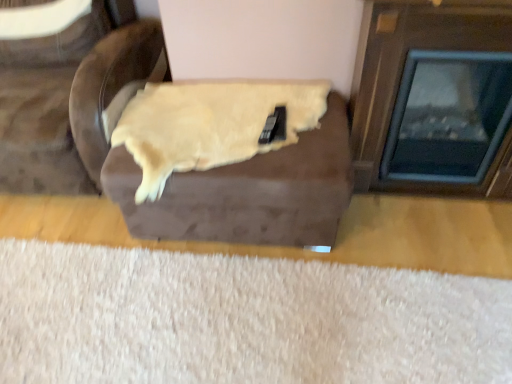
The width and height of the screenshot is (512, 384). What are the coordinates of `free space between brown suede ottoman at center, the second furniture in the left-to-right sequence, and white fluffy rug at lower center` in the screenshot? It's located at (314, 265).